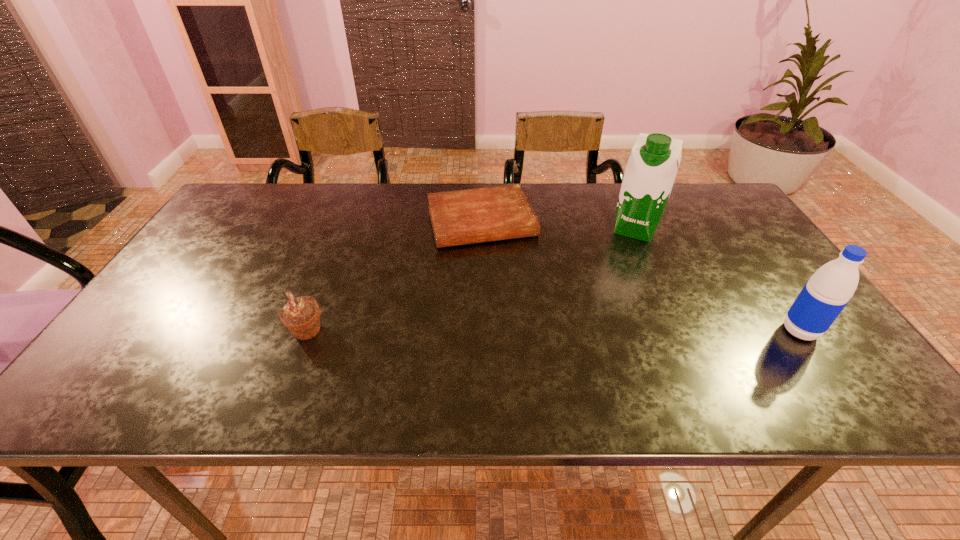
Locate an element on the screen. Image resolution: width=960 pixels, height=540 pixels. vacant space on the desktop that is between the muffin and the third shortest object and is positioned on the front-facing side of the soya milk is located at coordinates (597, 331).

What are the coordinates of `vacant spot on the desktop that is between the leftmost object and the rightmost object and is positioned on the spine side of the shortest object` in the screenshot? It's located at (519, 331).